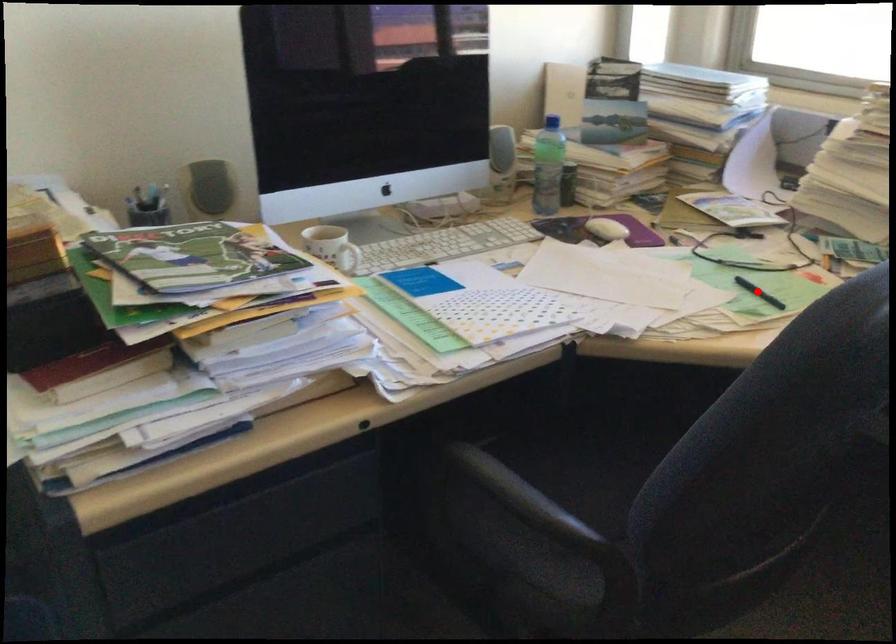
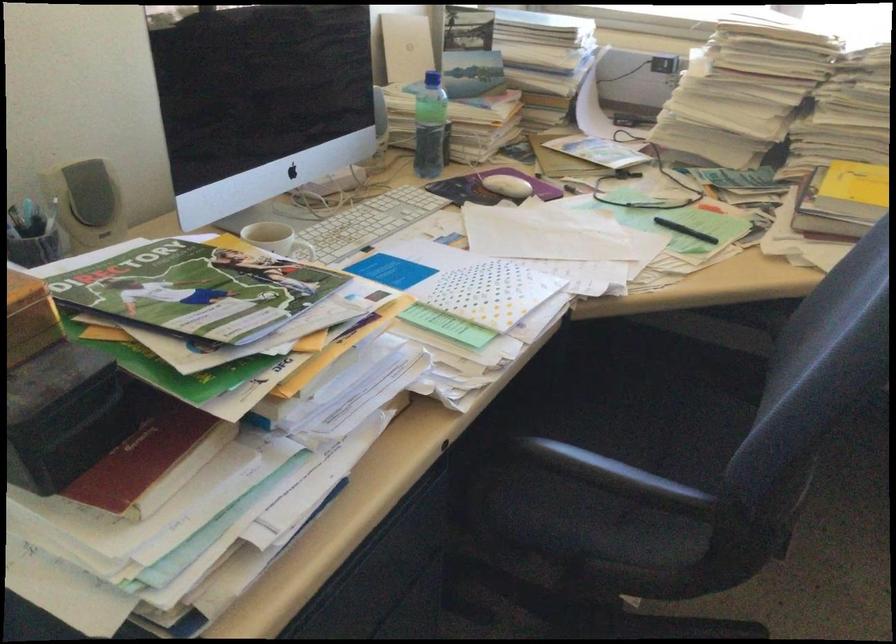
Where in the second image is the point corresponding to the highlighted location from the first image?

(684, 230)